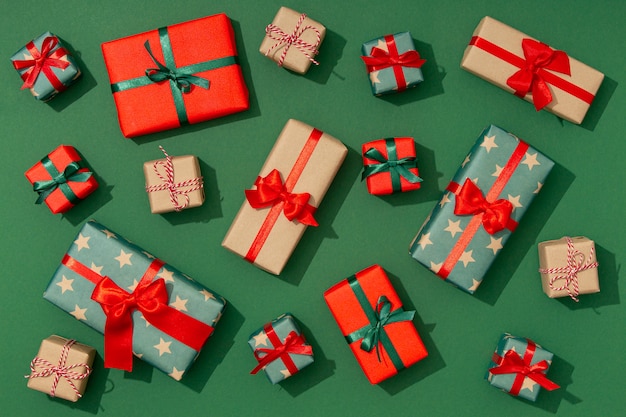
This screenshot has height=417, width=626. What are the coordinates of `gifts with red and white bow` in the screenshot? It's located at click(x=51, y=369), click(x=173, y=178), click(x=300, y=34), click(x=575, y=264).